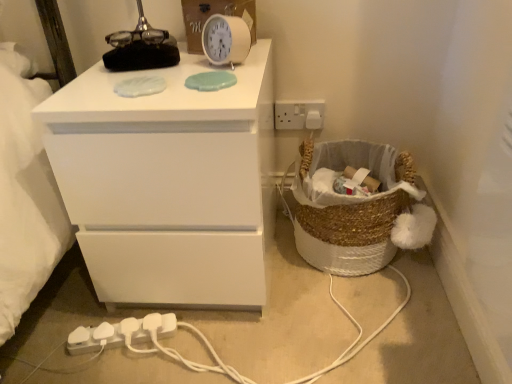
Where is `vacant space to the left of white plastic clock at upper center`? The image size is (512, 384). vacant space to the left of white plastic clock at upper center is located at coordinates (165, 71).